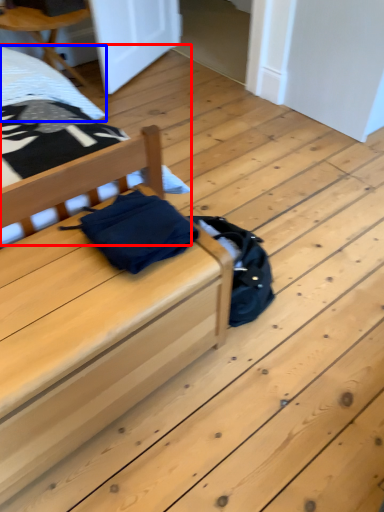
Question: Which of the following is the farthest to the observer, bed (highlighted by a red box) or sheet (highlighted by a blue box)?

Choices:
 (A) bed
 (B) sheet

Answer: (B)